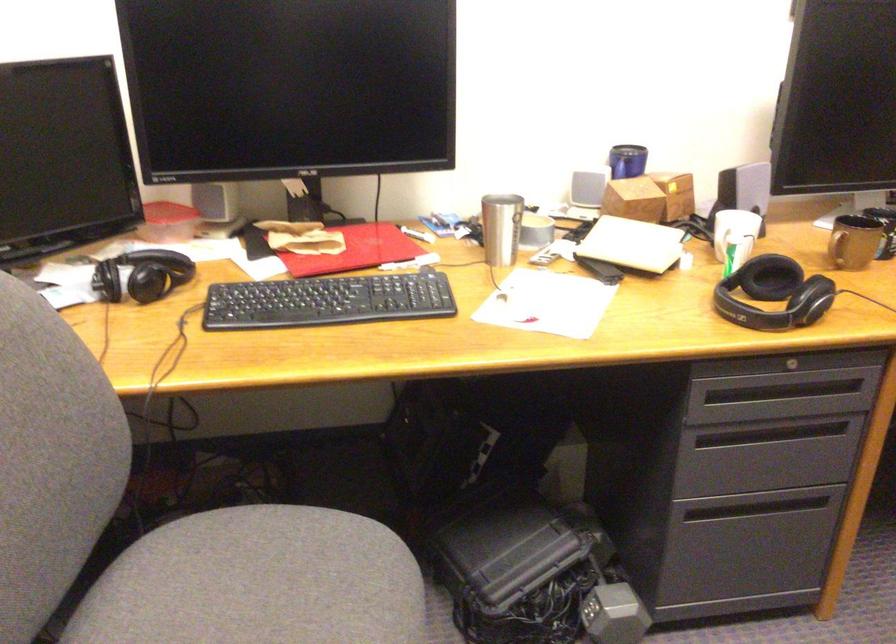
Where would you lift the white mug handle? Please return your answer as a coordinate pair (x, y).

(854, 242)